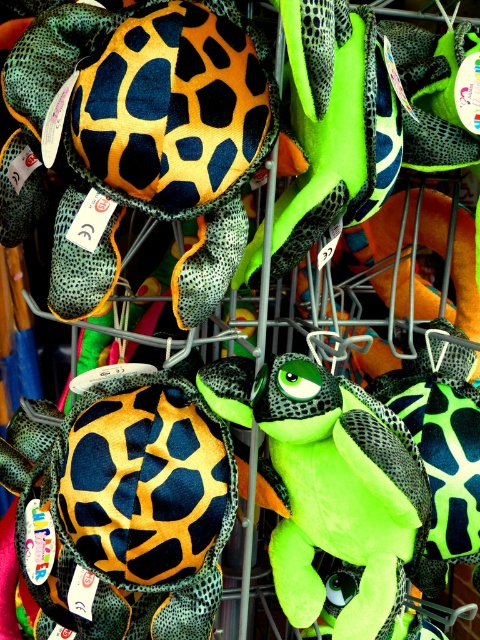
Which is more to the left, matte black plush turtle at center or neon green plush turtle at center?

matte black plush turtle at center is more to the left.

Who is taller, matte black plush turtle at center or neon green plush turtle at center?

matte black plush turtle at center is taller.

Who is more distant from viewer, (151, 404) or (365, 513)?

Positioned behind is point (151, 404).

The height and width of the screenshot is (640, 480). Identify the location of matte black plush turtle at center. (122, 509).

Is point (75, 168) positioned behind point (223, 458)?

No, (75, 168) is closer to viewer.

Does matte orange and black plush turtle at center lie behind matte black plush turtle at center?

No, it is in front of matte black plush turtle at center.

Who is more forward, (13, 61) or (158, 570)?

Point (13, 61)

This screenshot has height=640, width=480. In order to click on matte orange and black plush turtle at center in this screenshot , I will do `click(145, 136)`.

Between matte orange and black plush turtle at center and neon green plush turtle at center, which one is positioned lower?

neon green plush turtle at center is below.

Between matte orange and black plush turtle at center and neon green plush turtle at center, which one appears on the right side from the viewer's perspective?

Positioned to the right is neon green plush turtle at center.

Is point (218, 288) farther from viewer compared to point (422, 465)?

No.

Find the location of a particular element. Image resolution: width=480 pixels, height=640 pixels. matte orange and black plush turtle at center is located at coordinates coord(145,136).